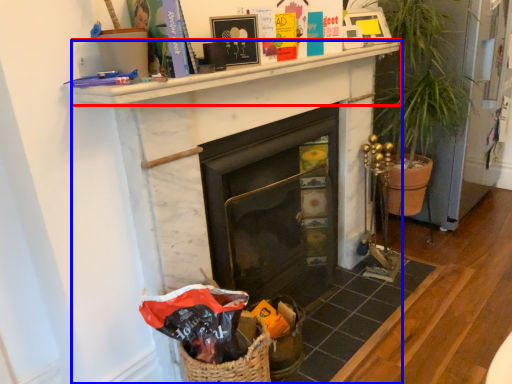
Question: Which object is further to the camera taking this photo, mantle (highlighted by a red box) or fireplace (highlighted by a blue box)?

Choices:
 (A) mantle
 (B) fireplace

Answer: (B)